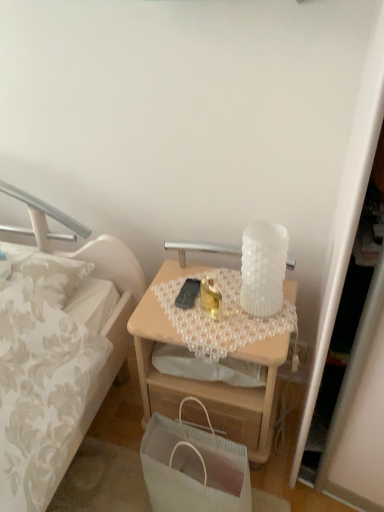
Question: Would you say white ribbed paper bag at lower center is to the left or to the right of light wood desk at center in the picture?

Choices:
 (A) right
 (B) left

Answer: (B)

Question: Considering the positions of white ribbed paper bag at lower center and light wood desk at center in the image, is white ribbed paper bag at lower center taller or shorter than light wood desk at center?

Choices:
 (A) short
 (B) tall

Answer: (A)

Question: Based on their relative distances, which object is farther from the white ribbed paper bag at lower center?

Choices:
 (A) white textured glass at upper center
 (B) black matte mobile phone at center
 (C) light wood desk at center

Answer: (A)

Question: Which object is positioned farthest from the white ribbed paper bag at lower center?

Choices:
 (A) black matte mobile phone at center
 (B) white textured glass at upper center
 (C) light wood desk at center

Answer: (B)